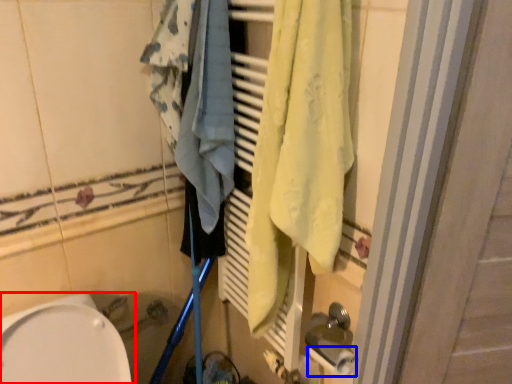
Question: Which of the following is the closest to the observer, toilet (highlighted by a red box) or toilet paper (highlighted by a blue box)?

Choices:
 (A) toilet
 (B) toilet paper

Answer: (A)